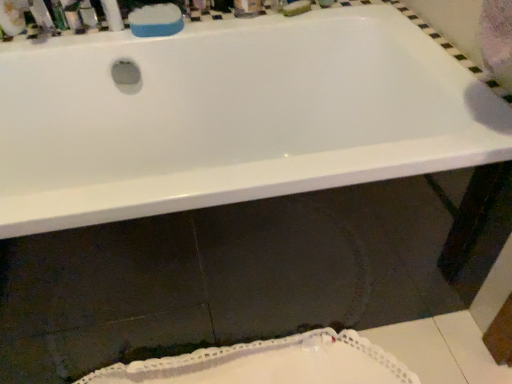
Question: Considering the relative positions of blue sponge at upper center and white lace doily at lower center in the image provided, is blue sponge at upper center in front of white lace doily at lower center?

Choices:
 (A) no
 (B) yes

Answer: (A)

Question: Is blue sponge at upper center looking in the opposite direction of white lace doily at lower center?

Choices:
 (A) no
 (B) yes

Answer: (A)

Question: Is blue sponge at upper center taller than white lace doily at lower center?

Choices:
 (A) yes
 (B) no

Answer: (B)

Question: Is blue sponge at upper center wider than white lace doily at lower center?

Choices:
 (A) yes
 (B) no

Answer: (B)

Question: From a real-world perspective, is blue sponge at upper center physically below white lace doily at lower center?

Choices:
 (A) no
 (B) yes

Answer: (A)

Question: Can you confirm if blue sponge at upper center is positioned to the left of white lace doily at lower center?

Choices:
 (A) yes
 (B) no

Answer: (A)

Question: Is the depth of metallic silver soap at upper left, which is counted as the first toiletry, starting from the left, less than that of white lace doily at lower center?

Choices:
 (A) yes
 (B) no

Answer: (B)

Question: Does metallic silver soap at upper left, the third toiletry viewed from the right, have a larger size compared to white lace doily at lower center?

Choices:
 (A) yes
 (B) no

Answer: (B)

Question: Considering the relative sizes of metallic silver soap at upper left, which is counted as the first toiletry, starting from the left, and white lace doily at lower center in the image provided, is metallic silver soap at upper left, which is counted as the first toiletry, starting from the left, smaller than white lace doily at lower center?

Choices:
 (A) no
 (B) yes

Answer: (B)

Question: Could you tell me if metallic silver soap at upper left, the third toiletry viewed from the right, is turned towards white lace doily at lower center?

Choices:
 (A) no
 (B) yes

Answer: (A)

Question: From a real-world perspective, does metallic silver soap at upper left, which is counted as the first toiletry, starting from the left, stand above white lace doily at lower center?

Choices:
 (A) no
 (B) yes

Answer: (B)

Question: Can you confirm if metallic silver container at upper left, which is the 1th toiletry from right to left, is shorter than white glossy bathtub at upper center?

Choices:
 (A) yes
 (B) no

Answer: (A)